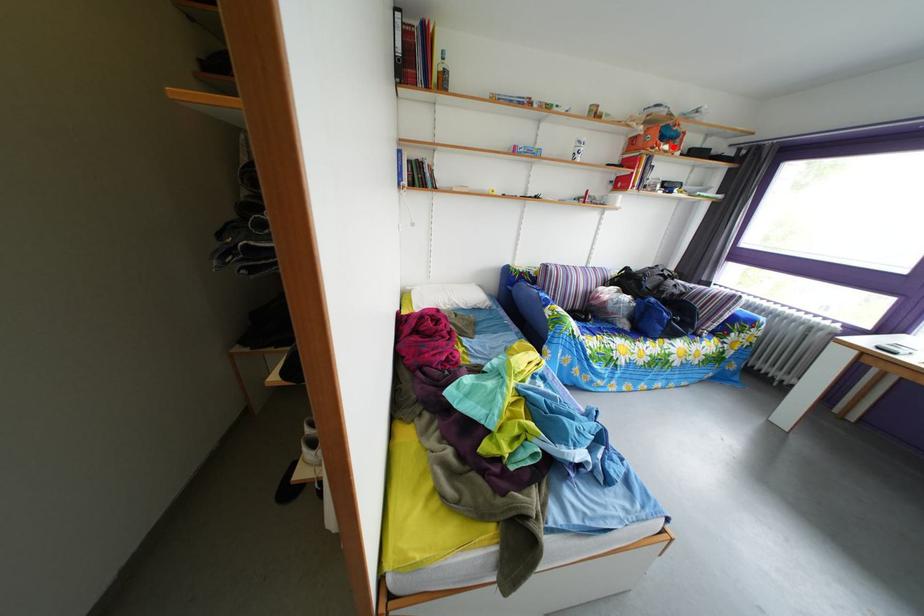
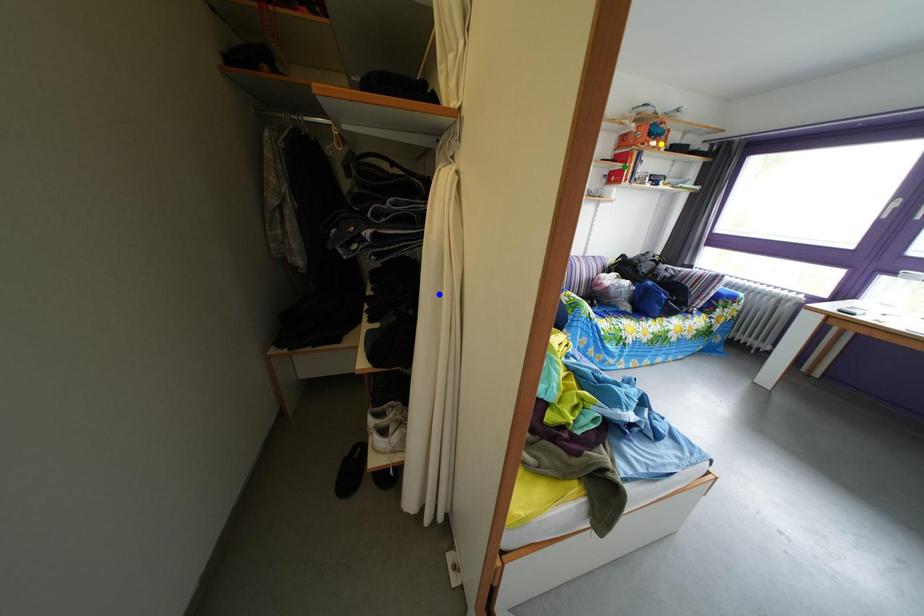
Question: I am providing you with two images of the same scene from different viewpoints. A red point is marked on the first image. You are given multiple points on the second image. In image 2, which mark is for the same physical point as the one in image 1?

Choices:
 (A) blue point
 (B) yellow point
 (C) green point

Answer: (B)